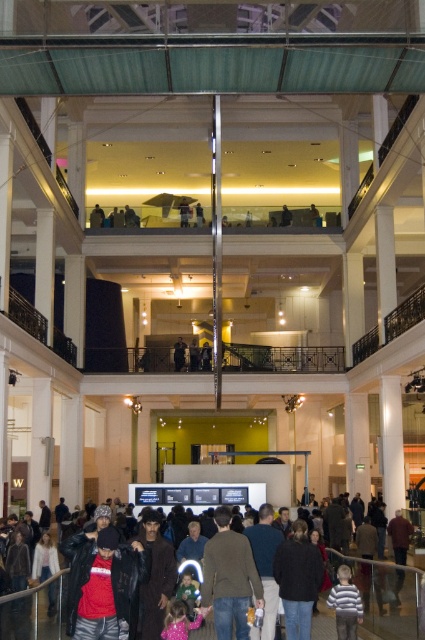
Can you confirm if dark clothing crowd at center is taller than dark brown leather jacket at center?

Indeed, dark clothing crowd at center has a greater height compared to dark brown leather jacket at center.

Who is more distant from viewer, (135, 600) or (181, 364)?

Point (181, 364)

Between point (34, 595) and point (181, 349), which one is positioned in front?

Point (34, 595)

Identify the location of dark clothing crowd at center. (x=40, y=604).

Can you confirm if brown wool sweater at center is thinner than dark brown leather jacket at center?

No, brown wool sweater at center is not thinner than dark brown leather jacket at center.

Which is in front, point (215, 614) or point (178, 349)?

Point (215, 614) is in front.

Where is `brown wool sweater at center`? Image resolution: width=425 pixels, height=640 pixels. brown wool sweater at center is located at coordinates (229, 579).

The image size is (425, 640). What are the coordinates of `brown wool sweater at center` in the screenshot? It's located at tap(229, 579).

Does dark clothing crowd at center lie behind brown wool sweater at center?

No, dark clothing crowd at center is closer to the viewer.

The height and width of the screenshot is (640, 425). Describe the element at coordinates (40, 604) in the screenshot. I see `dark clothing crowd at center` at that location.

Is point (263, 588) positioned before point (234, 611)?

No, (263, 588) is further to viewer.

Find the location of a particular element. dark clothing crowd at center is located at coordinates tap(40, 604).